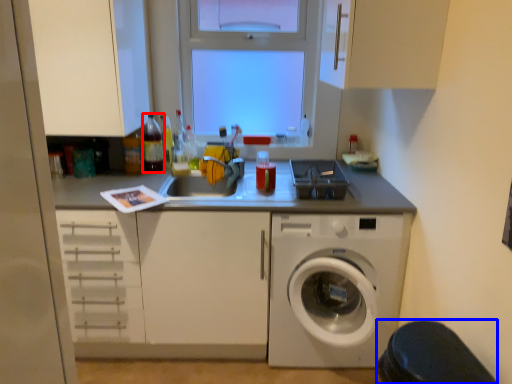
Question: Which object is further to the camera taking this photo, bottle (highlighted by a red box) or step stool (highlighted by a blue box)?

Choices:
 (A) bottle
 (B) step stool

Answer: (A)